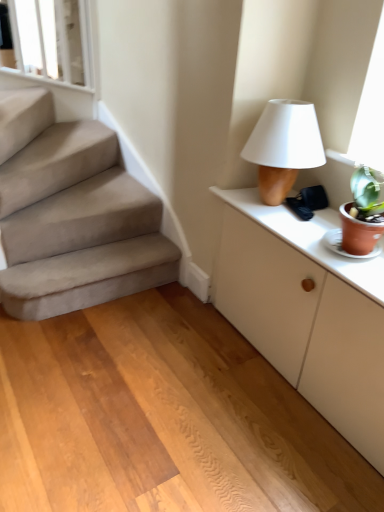
Where is `white matte cabinet at right`? The height and width of the screenshot is (512, 384). white matte cabinet at right is located at coordinates (309, 239).

From the picture: Is matte brown table lamp at upper right positioned far away from white matte cabinet at right?

No, matte brown table lamp at upper right is in close proximity to white matte cabinet at right.

Considering the positions of points (320, 162) and (345, 262), is point (320, 162) closer to camera compared to point (345, 262)?

No.

How many degrees apart are the facing directions of matte brown table lamp at upper right and white matte cabinet at right?

The angle between the facing direction of matte brown table lamp at upper right and the facing direction of white matte cabinet at right is 0.00118 degrees.

In the image, there is a white glossy window frame at upper left. Identify the location of cabinetry below it (from the image's perspective). Image resolution: width=384 pixels, height=512 pixels. (307, 312).

Is white matte cabinet at right positioned behind white glossy window frame at upper left?

No, white matte cabinet at right is closer to the viewer.

Is white matte cabinet at right positioned far away from white glossy window frame at upper left?

Yes, white matte cabinet at right is far from white glossy window frame at upper left.

Is white matte cabinet at right outside of white glossy window frame at upper left?

white matte cabinet at right lies outside white glossy window frame at upper left's area.

How distant is wooden floor at center from white matte cabinet at right?

wooden floor at center is 28.66 inches away from white matte cabinet at right.

Would you say wooden floor at center is outside white matte cabinet at right?

Yes, wooden floor at center is not within white matte cabinet at right.

From the image's perspective, who appears lower, wooden floor at center or white matte cabinet at right?

From the image's view, wooden floor at center is below.

Is point (278, 503) farther from viewer compared to point (250, 190)?

No, it is not.

Does white matte cabinet at right turn towards matte brown table lamp at upper right?

No, white matte cabinet at right is not aimed at matte brown table lamp at upper right.

From a real-world perspective, is white matte cabinet at right positioned above or below matte brown table lamp at upper right?

In terms of real-world spatial position, white matte cabinet at right is below matte brown table lamp at upper right.

From the image's perspective, is white matte cabinet at right above or below matte brown table lamp at upper right?

Based on their image positions, white matte cabinet at right is located beneath matte brown table lamp at upper right.

Is white matte cabinet at right completely or partially outside of matte brown table lamp at upper right?

Absolutely, white matte cabinet at right is external to matte brown table lamp at upper right.

Can you confirm if matte brown table lamp at upper right is taller than white glossy window frame at upper left?

No, matte brown table lamp at upper right is not taller than white glossy window frame at upper left.

From the picture: Does matte brown table lamp at upper right have a lesser width compared to white glossy window frame at upper left?

No.

Is point (295, 169) closer to camera compared to point (27, 10)?

Yes, it is in front of point (27, 10).

Would you say white matte cabinet at right is a long distance from white matte cabinet at right?

No.

Can you confirm if white matte cabinet at right is taller than white matte cabinet at right?

In fact, white matte cabinet at right may be shorter than white matte cabinet at right.

Considering the relative positions of white matte cabinet at right and white matte cabinet at right in the image provided, is white matte cabinet at right to the left or to the right of white matte cabinet at right?

In the image, white matte cabinet at right appears on the left side of white matte cabinet at right.

Is white matte cabinet at right oriented towards white matte cabinet at right?

No, white matte cabinet at right is not aimed at white matte cabinet at right.

Considering the relative positions of white matte cabinet at right and white glossy window frame at upper left in the image provided, is white matte cabinet at right to the right of white glossy window frame at upper left from the viewer's perspective?

Indeed, white matte cabinet at right is positioned on the right side of white glossy window frame at upper left.

From a real-world perspective, which object rests below the other?

white matte cabinet at right, from a real-world perspective.

Can you tell me how much white matte cabinet at right and white glossy window frame at upper left differ in facing direction?

0.000576 degrees separate the facing orientations of white matte cabinet at right and white glossy window frame at upper left.

In the scene shown: Does white matte cabinet at right have a greater height compared to white glossy window frame at upper left?

In fact, white matte cabinet at right may be shorter than white glossy window frame at upper left.

This screenshot has height=512, width=384. Find the location of `counter top to the right of matte brown table lamp at upper right`. counter top to the right of matte brown table lamp at upper right is located at coordinates (309, 239).

Identify the location of cabinetry beneath the white glossy window frame at upper left (from a real-world perspective). (307, 312).

Based on their spatial positions, is white glossy window frame at upper left or white matte cabinet at right closer to wooden floor at center?

Based on the image, white matte cabinet at right appears to be nearer to wooden floor at center.

From the image, which object appears to be farther from white matte cabinet at right, wooden floor at center or white glossy window frame at upper left?

Based on the image, white glossy window frame at upper left appears to be further to white matte cabinet at right.

Which object lies further to the anchor point white matte cabinet at right, white matte cabinet at right or matte brown table lamp at upper right?

matte brown table lamp at upper right is positioned further to the anchor white matte cabinet at right.

Based on their spatial positions, is white matte cabinet at right or white matte cabinet at right further from wooden floor at center?

The object further to wooden floor at center is white matte cabinet at right.

From the image, which object appears to be farther from wooden floor at center, white matte cabinet at right or white matte cabinet at right?

The object further to wooden floor at center is white matte cabinet at right.

Estimate the real-world distances between objects in this image. Which object is further from white glossy window frame at upper left, wooden floor at center or white matte cabinet at right?

white matte cabinet at right is further to white glossy window frame at upper left.

Looking at the image, which one is located closer to white matte cabinet at right, matte brown table lamp at upper right or white glossy window frame at upper left?

matte brown table lamp at upper right.

From the image, which object appears to be farther from matte brown table lamp at upper right, wooden floor at center or white matte cabinet at right?

Among the two, wooden floor at center is located further to matte brown table lamp at upper right.

Where is `table lamp between white glossy window frame at upper left and white matte cabinet at right from left to right`? The height and width of the screenshot is (512, 384). table lamp between white glossy window frame at upper left and white matte cabinet at right from left to right is located at coordinates (284, 147).

The image size is (384, 512). I want to click on cabinetry between white glossy window frame at upper left and wooden floor at center from top to bottom, so click(307, 312).

Locate an element on the screen. cabinetry that lies between matte brown table lamp at upper right and wooden floor at center from top to bottom is located at coordinates (307, 312).

Find the location of a particular element. The height and width of the screenshot is (512, 384). counter top between wooden floor at center and white matte cabinet at right is located at coordinates (309, 239).